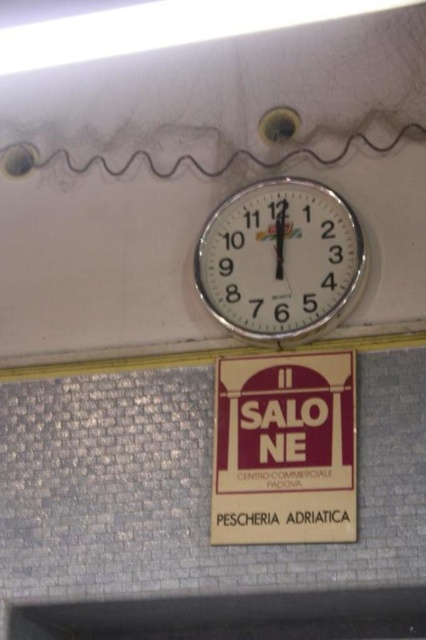
Is matte brown sign at center smaller than metallic clock at upper center?

Indeed, matte brown sign at center has a smaller size compared to metallic clock at upper center.

Who is taller, matte brown sign at center or metallic clock at upper center?

metallic clock at upper center

Is point (242, 364) positioned after point (293, 186)?

No, it is not.

At what (x,y) coordinates should I click in order to perform the action: click on matte brown sign at center. Please return your answer as a coordinate pair (x, y). Looking at the image, I should click on tap(284, 449).